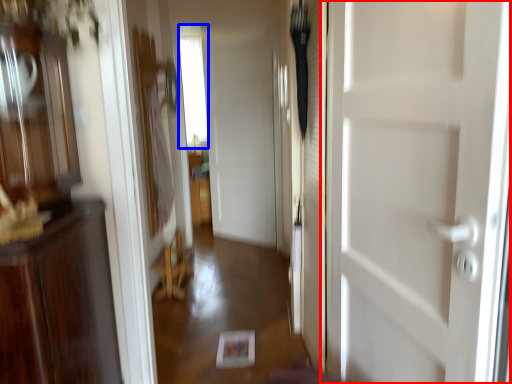
Question: Which object appears farthest to the camera in this image, door (highlighted by a red box) or window (highlighted by a blue box)?

Choices:
 (A) door
 (B) window

Answer: (B)